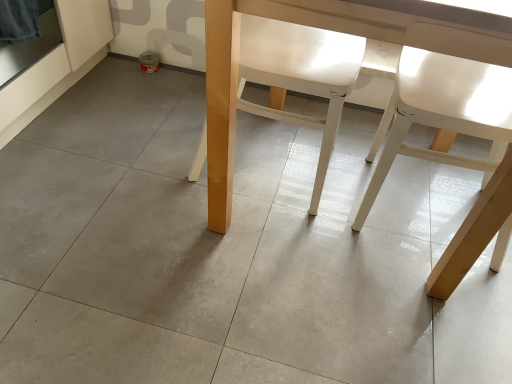
In order to face matte wood table at center, should I rotate leftwards or rightwards?

A 15.005 degree turn to the right will do.

This screenshot has height=384, width=512. What are the coordinates of `matte wood table at center` in the screenshot? It's located at (332, 30).

In order to click on white matte chair at right, which appears as the 1th chair when viewed from the right in this screenshot , I will do pyautogui.click(x=453, y=155).

Looking at this image, which is in front, white matte chair at right, the second chair positioned from the left, or matte wood table at center?

matte wood table at center.

From the image's perspective, would you say white matte chair at right, the second chair positioned from the left, is positioned over matte wood table at center?

No.

I want to click on the 1st chair behind when counting from the matte wood table at center, so click(x=453, y=155).

How far apart are matte wood table at center and white matte chair at center, marked as the first chair in a left-to-right arrangement?

matte wood table at center and white matte chair at center, marked as the first chair in a left-to-right arrangement, are 8.31 inches apart.

From the image's perspective, relative to white matte chair at center, marked as the first chair in a left-to-right arrangement, is matte wood table at center above or below?

matte wood table at center is below white matte chair at center, marked as the first chair in a left-to-right arrangement.

This screenshot has width=512, height=384. Identify the location of table in front of the white matte chair at center, marked as the first chair in a left-to-right arrangement. (332, 30).

Looking at the image, does matte wood table at center seem bigger or smaller compared to white matte chair at center, the 2th chair viewed from the right?

In the image, matte wood table at center appears to be larger than white matte chair at center, the 2th chair viewed from the right.

From the image's perspective, between white matte chair at center, marked as the first chair in a left-to-right arrangement, and white matte chair at right, which appears as the 1th chair when viewed from the right, who is located below?

white matte chair at right, which appears as the 1th chair when viewed from the right, appears lower in the image.

Looking at their sizes, would you say white matte chair at center, marked as the first chair in a left-to-right arrangement, is wider or thinner than white matte chair at right, the second chair positioned from the left?

white matte chair at center, marked as the first chair in a left-to-right arrangement, is wider than white matte chair at right, the second chair positioned from the left.

From a real-world perspective, is white matte chair at center, the 2th chair viewed from the right, physically below white matte chair at right, the second chair positioned from the left?

No, from a real-world perspective, white matte chair at center, the 2th chair viewed from the right, is not beneath white matte chair at right, the second chair positioned from the left.

Which is nearer, [325,67] or [487,208]?

The point [487,208] is in front.

Relative to white matte chair at right, which appears as the 1th chair when viewed from the right, is matte wood table at center in front or behind?

matte wood table at center is positioned closer to the viewer than white matte chair at right, which appears as the 1th chair when viewed from the right.

In terms of width, does matte wood table at center look wider or thinner when compared to white matte chair at right, the second chair positioned from the left?

Clearly, matte wood table at center has more width compared to white matte chair at right, the second chair positioned from the left.

Is matte wood table at center to the left of white matte chair at right, the second chair positioned from the left, from the viewer's perspective?

Yes.

How distant is white matte chair at right, which appears as the 1th chair when viewed from the right, from white matte chair at center, the 2th chair viewed from the right?

white matte chair at right, which appears as the 1th chair when viewed from the right, is 11.00 inches from white matte chair at center, the 2th chair viewed from the right.

At what (x,y) coordinates should I click in order to perform the action: click on chair to the left of white matte chair at right, the second chair positioned from the left. Please return your answer as a coordinate pair (x, y). Looking at the image, I should click on (300, 75).

Looking at this image, from a real-world perspective, is white matte chair at right, which appears as the 1th chair when viewed from the right, positioned under white matte chair at center, marked as the first chair in a left-to-right arrangement, based on gravity?

Yes, from a real-world perspective, white matte chair at right, which appears as the 1th chair when viewed from the right, is below white matte chair at center, marked as the first chair in a left-to-right arrangement.

Which of these two, white matte chair at right, the second chair positioned from the left, or white matte chair at center, marked as the first chair in a left-to-right arrangement, is thinner?

white matte chair at right, the second chair positioned from the left, is thinner.

Considering the relative sizes of white matte chair at center, the 2th chair viewed from the right, and matte wood table at center in the image provided, is white matte chair at center, the 2th chair viewed from the right, wider than matte wood table at center?

No, white matte chair at center, the 2th chair viewed from the right, is not wider than matte wood table at center.

Is white matte chair at center, marked as the first chair in a left-to-right arrangement, to the left of matte wood table at center from the viewer's perspective?

Correct, you'll find white matte chair at center, marked as the first chair in a left-to-right arrangement, to the left of matte wood table at center.

Is white matte chair at center, marked as the first chair in a left-to-right arrangement, surrounding matte wood table at center?

No, matte wood table at center is not a part of white matte chair at center, marked as the first chair in a left-to-right arrangement.

Considering the relative sizes of white matte chair at center, the 2th chair viewed from the right, and matte wood table at center in the image provided, is white matte chair at center, the 2th chair viewed from the right, shorter than matte wood table at center?

Yes, white matte chair at center, the 2th chair viewed from the right, is shorter than matte wood table at center.

This screenshot has width=512, height=384. I want to click on the 2nd chair below the matte wood table at center (from a real-world perspective), so click(x=453, y=155).

Identify the location of table positioned vertically above the white matte chair at center, the 2th chair viewed from the right (from a real-world perspective). This screenshot has height=384, width=512. (332, 30).

Based on their spatial positions, is white matte chair at right, which appears as the 1th chair when viewed from the right, or matte wood table at center closer to white matte chair at center, marked as the first chair in a left-to-right arrangement?

matte wood table at center lies closer to white matte chair at center, marked as the first chair in a left-to-right arrangement, than the other object.

Looking at the image, which one is located closer to matte wood table at center, white matte chair at right, which appears as the 1th chair when viewed from the right, or white matte chair at center, the 2th chair viewed from the right?

The object closer to matte wood table at center is white matte chair at center, the 2th chair viewed from the right.

Based on their spatial positions, is white matte chair at center, marked as the first chair in a left-to-right arrangement, or matte wood table at center closer to white matte chair at right, the second chair positioned from the left?

white matte chair at center, marked as the first chair in a left-to-right arrangement, is closer to white matte chair at right, the second chair positioned from the left.

From the picture: Based on their spatial positions, is white matte chair at center, marked as the first chair in a left-to-right arrangement, or white matte chair at right, which appears as the 1th chair when viewed from the right, closer to matte wood table at center?

white matte chair at center, marked as the first chair in a left-to-right arrangement, is positioned closer to the anchor matte wood table at center.

Considering their positions, is matte wood table at center positioned closer to white matte chair at right, which appears as the 1th chair when viewed from the right, than white matte chair at center, the 2th chair viewed from the right?

white matte chair at center, the 2th chair viewed from the right, lies closer to white matte chair at right, which appears as the 1th chair when viewed from the right, than the other object.

Estimate the real-world distances between objects in this image. Which object is closer to white matte chair at center, the 2th chair viewed from the right, matte wood table at center or white matte chair at right, the second chair positioned from the left?

matte wood table at center is positioned closer to the anchor white matte chair at center, the 2th chair viewed from the right.

The height and width of the screenshot is (384, 512). Find the location of `table situated between white matte chair at center, the 2th chair viewed from the right, and white matte chair at right, which appears as the 1th chair when viewed from the right, from left to right`. table situated between white matte chair at center, the 2th chair viewed from the right, and white matte chair at right, which appears as the 1th chair when viewed from the right, from left to right is located at coordinates (332, 30).